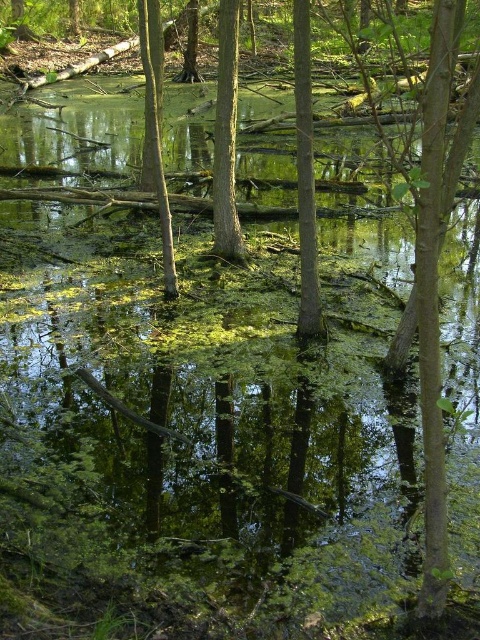
Is point (214, 170) positioned in front of point (167, 284)?

No, it is behind (167, 284).

Which is above, green rough bark tree at center or smooth brown tree trunk at center?

smooth brown tree trunk at center is above.

This screenshot has height=640, width=480. Find the location of `green rough bark tree at center`. green rough bark tree at center is located at coordinates (226, 140).

Is smooth bark tree at center taller than green rough bark tree at center?

Indeed, smooth bark tree at center has a greater height compared to green rough bark tree at center.

Does smooth bark tree at center appear on the left side of green rough bark tree at center?

In fact, smooth bark tree at center is to the right of green rough bark tree at center.

You are a GUI agent. You are given a task and a screenshot of the screen. Output one action in this format:
    pyautogui.click(x=<x>, y=<y>)
    Task: Click on the smooth bark tree at center
    
    Given the screenshot: What is the action you would take?
    pos(305,177)

Does smooth bark tree at center have a smaller size compared to smooth brown tree trunk at center?

Incorrect, smooth bark tree at center is not smaller in size than smooth brown tree trunk at center.

Who is higher up, smooth bark tree at center or smooth brown tree trunk at center?

Positioned higher is smooth bark tree at center.

This screenshot has width=480, height=640. Identify the location of smooth bark tree at center. (305, 177).